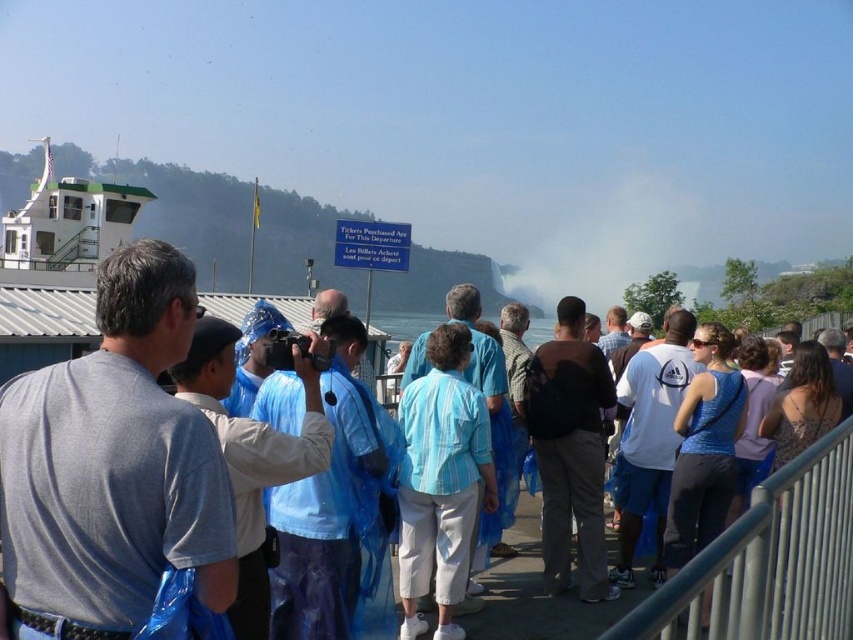
From the picture: You are a tour guide who needs to ensure safety by checking if the blue plastic bag at center and the blue fabric dress at center can both fit on a shelf that is 1 meter wide. Given their widths, can they be placed side by side without overlapping?

The blue plastic bag at center is wider than the blue fabric dress at center. Since their combined widths exceed 1 meter, they cannot be placed side by side on the shelf without overlapping.

You are standing at the edge of the viewing platform and want to take a photo of the point at coordinates (329, 442). If your camera has a maximum focus range of 10 meters, will it be able to capture the point clearly?

The point at coordinates (329, 442) is 9.55 meters away from the camera, which is within the maximum focus range of 10 meters. Therefore, the camera should be able to capture the point clearly.